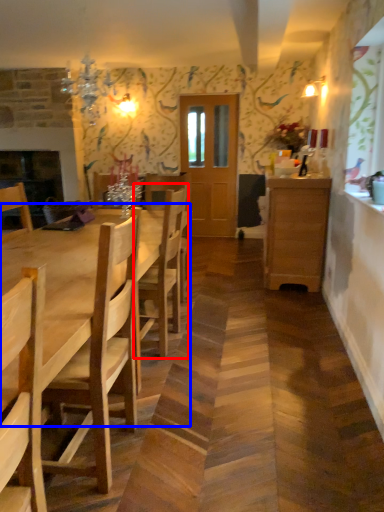
Question: Among these objects, which one is farthest to the camera, chair (highlighted by a red box) or kitchen & dining room table (highlighted by a blue box)?

Choices:
 (A) chair
 (B) kitchen & dining room table

Answer: (A)